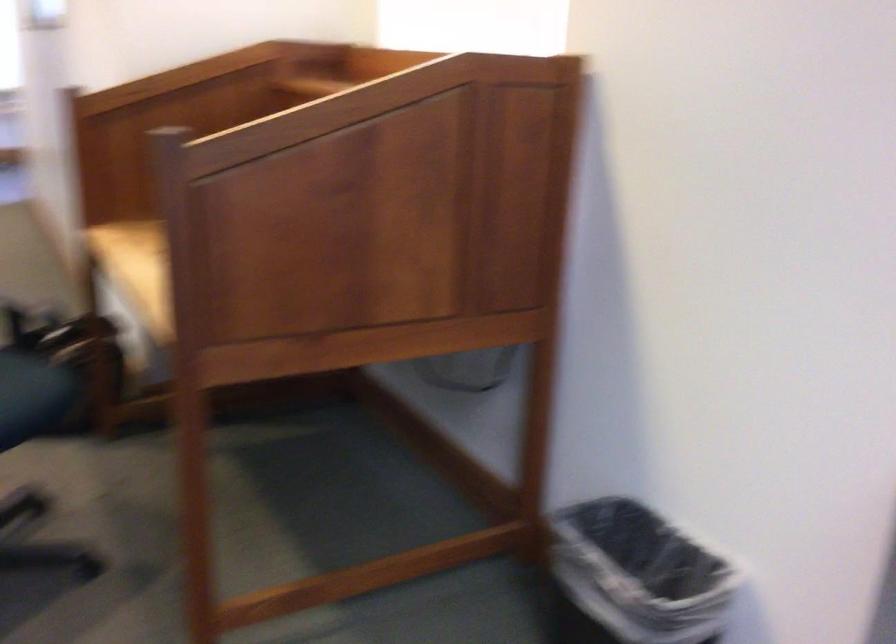
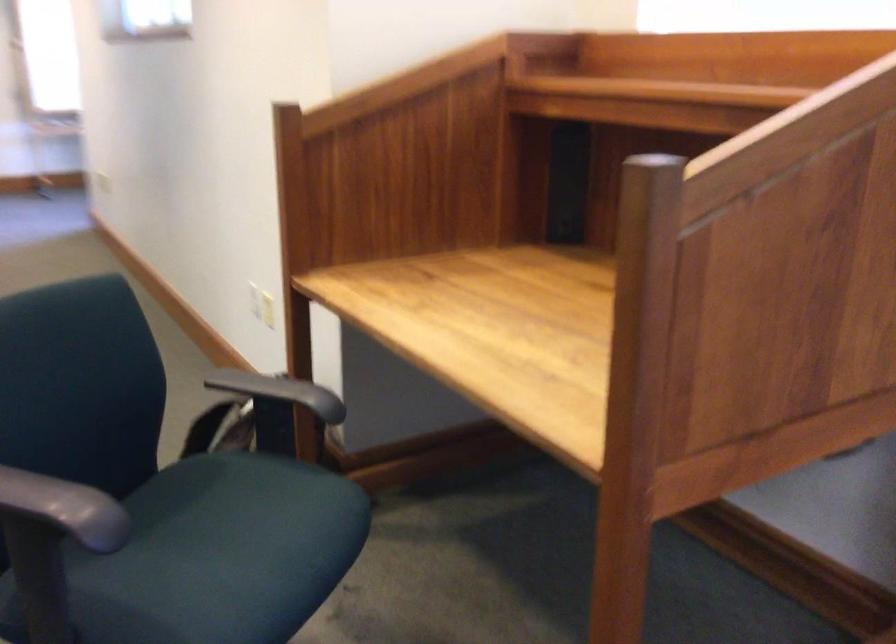
Question: The images are taken continuously from a first-person perspective. In which direction is your viewpoint rotating?

Choices:
 (A) Left
 (B) Right
 (C) Up
 (D) Down

Answer: (A)